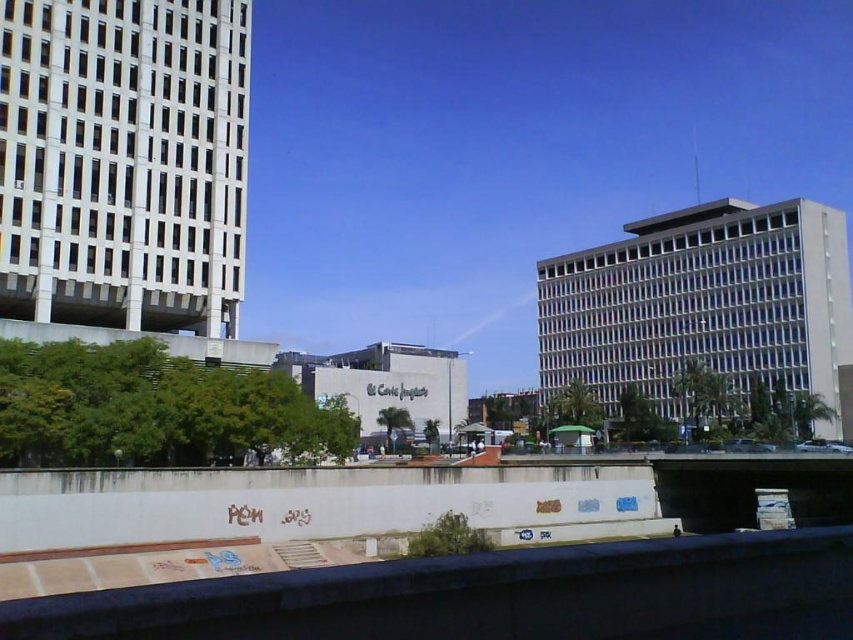
You are standing at the point closest to the camera in the image. Which point are you at, point (100, 131) or point (654, 349)?

You are at point (100, 131) because it is closer to the camera than point (654, 349).

You are standing at the point marked by coordinates point (123,161) in the urban landscape. Which building are you facing? Please choose from the following options based on the scene description provided. The options are the white glass building at left, the rounded El Corte Ingl s building in the center, or the other large building on the right.

The point (123,161) corresponds to the white glass building at left, so you are facing the white glass building at left.